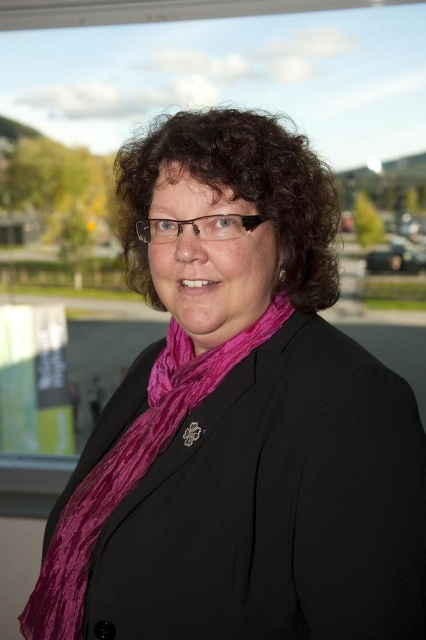
In the scene shown: Does dark brown curly hair at center appear over velvet purple scarf at center?

Yes, dark brown curly hair at center is above velvet purple scarf at center.

Is dark brown curly hair at center further to camera compared to velvet purple scarf at center?

No.

You are a GUI agent. You are given a task and a screenshot of the screen. Output one action in this format:
    pyautogui.click(x=<x>, y=<y>)
    Task: Click on the dark brown curly hair at center
    This screenshot has width=426, height=640.
    Given the screenshot: What is the action you would take?
    pyautogui.click(x=238, y=193)